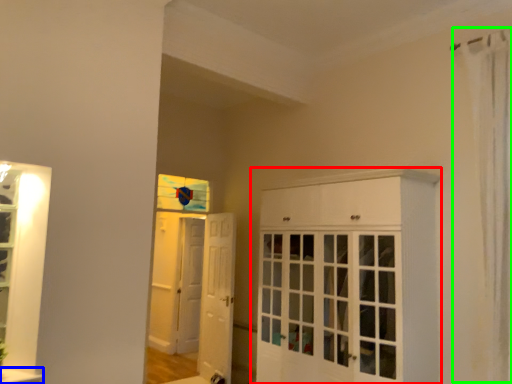
Question: Considering the real-world distances, which object is farthest from cabinetry (highlighted by a red box)? window sill (highlighted by a blue box) or shower curtain (highlighted by a green box)?

Choices:
 (A) window sill
 (B) shower curtain

Answer: (A)